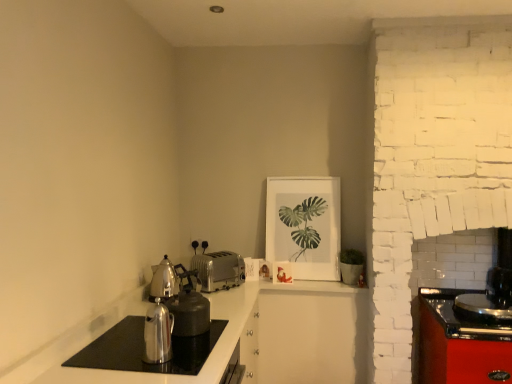
Image resolution: width=512 pixels, height=384 pixels. I want to click on free location to the left of shiny metallic kettle at lower left, so click(117, 362).